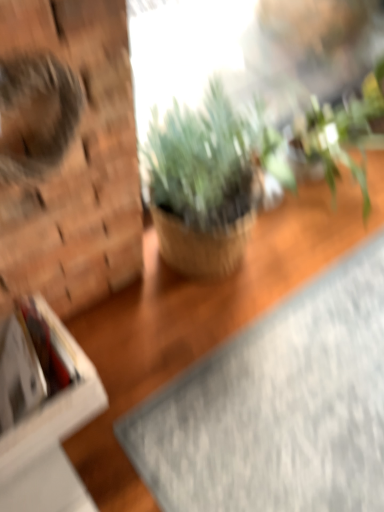
Question: Does green leafy plant at upper right, which ranks as the second houseplant in left-to-right order, have a greater width compared to gray textured yoga mat at lower right?

Choices:
 (A) yes
 (B) no

Answer: (B)

Question: Considering the relative sizes of green leafy plant at upper right, which ranks as the second houseplant in left-to-right order, and gray textured yoga mat at lower right in the image provided, is green leafy plant at upper right, which ranks as the second houseplant in left-to-right order, taller than gray textured yoga mat at lower right?

Choices:
 (A) yes
 (B) no

Answer: (A)

Question: From the image's perspective, is green leafy plant at upper right, arranged as the first houseplant when viewed from the right, on gray textured yoga mat at lower right?

Choices:
 (A) yes
 (B) no

Answer: (A)

Question: Does green leafy plant at upper right, which ranks as the second houseplant in left-to-right order, lie behind gray textured yoga mat at lower right?

Choices:
 (A) yes
 (B) no

Answer: (A)

Question: Is green leafy plant at upper right, which ranks as the second houseplant in left-to-right order, looking in the opposite direction of gray textured yoga mat at lower right?

Choices:
 (A) yes
 (B) no

Answer: (B)

Question: Is green matte plant at center, the 2th houseplant in the right-to-left sequence, situated inside green leafy plant at upper right, which ranks as the second houseplant in left-to-right order, or outside?

Choices:
 (A) inside
 (B) outside

Answer: (B)

Question: Relative to green leafy plant at upper right, which ranks as the second houseplant in left-to-right order, is green matte plant at center, the 2th houseplant in the right-to-left sequence, in front or behind?

Choices:
 (A) front
 (B) behind

Answer: (A)

Question: From their relative heights in the image, would you say green matte plant at center, which is counted as the first houseplant, starting from the left, is taller or shorter than green leafy plant at upper right, arranged as the first houseplant when viewed from the right?

Choices:
 (A) tall
 (B) short

Answer: (A)

Question: Would you say green matte plant at center, the 2th houseplant in the right-to-left sequence, is to the left or to the right of green leafy plant at upper right, arranged as the first houseplant when viewed from the right, in the picture?

Choices:
 (A) right
 (B) left

Answer: (B)

Question: Does point (8, 458) appear closer or farther from the camera than point (375, 111)?

Choices:
 (A) farther
 (B) closer

Answer: (B)

Question: Relative to green leafy plant at upper right, arranged as the first houseplant when viewed from the right, is white cardboard box at left in front or behind?

Choices:
 (A) behind
 (B) front

Answer: (B)

Question: In terms of width, does white cardboard box at left look wider or thinner when compared to green leafy plant at upper right, which ranks as the second houseplant in left-to-right order?

Choices:
 (A) wide
 (B) thin

Answer: (B)

Question: From a real-world perspective, is white cardboard box at left positioned above or below green leafy plant at upper right, which ranks as the second houseplant in left-to-right order?

Choices:
 (A) above
 (B) below

Answer: (B)

Question: In terms of height, does gray textured yoga mat at lower right look taller or shorter compared to white cardboard box at left?

Choices:
 (A) short
 (B) tall

Answer: (A)

Question: Is gray textured yoga mat at lower right spatially inside white cardboard box at left, or outside of it?

Choices:
 (A) inside
 (B) outside

Answer: (B)